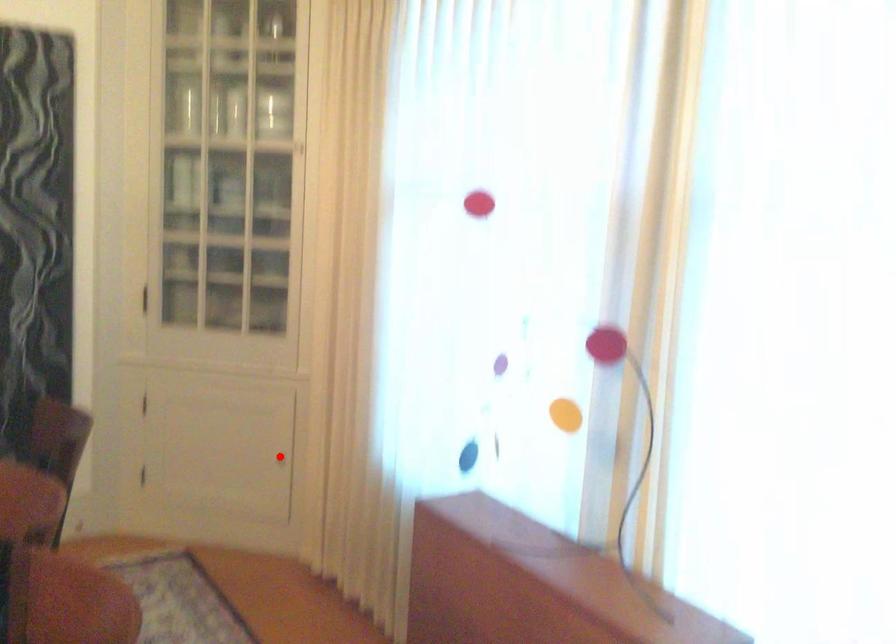
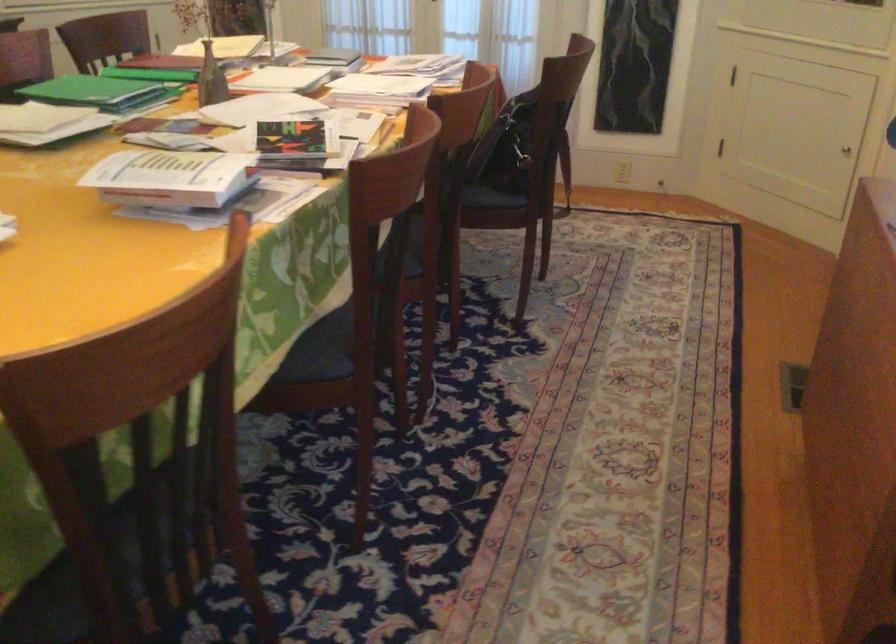
Find the pixel in the second image that matches the highlighted location in the first image.

(846, 149)